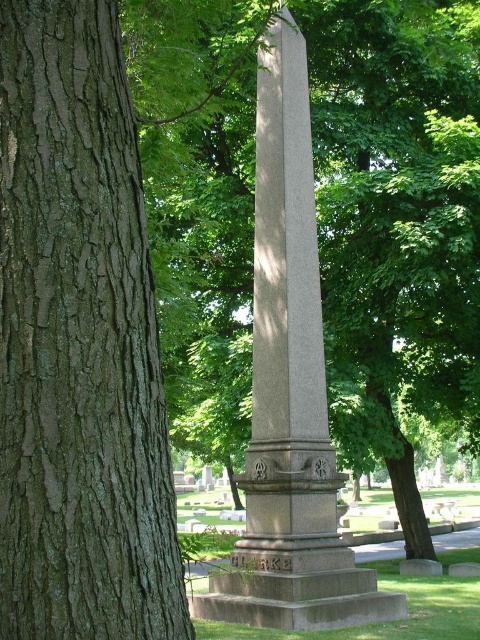
Question: Which object is farther from the camera taking this photo?

Choices:
 (A) gray stone obelisk at center
 (B) brown rough bark at left

Answer: (A)

Question: Does brown rough bark at left have a greater width compared to gray stone obelisk at center?

Choices:
 (A) yes
 (B) no

Answer: (B)

Question: Can you confirm if brown rough bark at left is bigger than gray stone obelisk at center?

Choices:
 (A) no
 (B) yes

Answer: (A)

Question: Can you confirm if brown rough bark at left is positioned above gray stone obelisk at center?

Choices:
 (A) yes
 (B) no

Answer: (B)